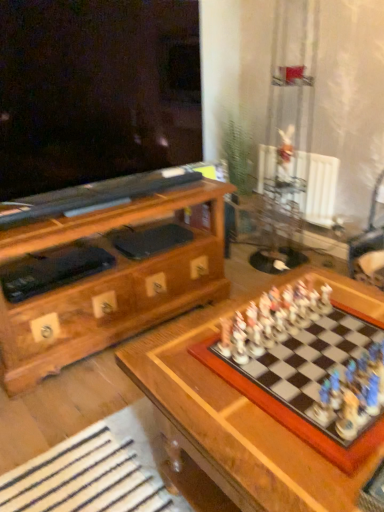
Find the location of a particular element. The width and height of the screenshot is (384, 512). free spot above wooden chessboard at center (from a real-world perspective) is located at coordinates (293, 367).